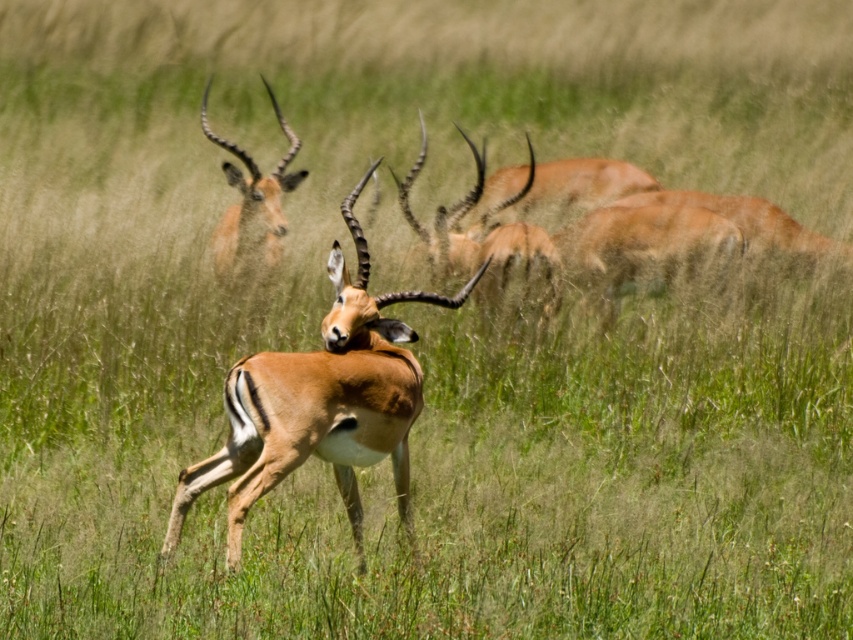
Question: Considering the relative positions of brown glossy antelope at center and brown velvet antelope at center in the image provided, where is brown glossy antelope at center located with respect to brown velvet antelope at center?

Choices:
 (A) left
 (B) right

Answer: (A)

Question: Which object is the farthest from the brown glossy antelope at center?

Choices:
 (A) brown velvet antelope at center
 (B) brown velvet antelope at upper left

Answer: (B)

Question: Which point is farther from the camera taking this photo?

Choices:
 (A) (398, 193)
 (B) (274, 99)

Answer: (A)

Question: Which point is farther from the camera taking this photo?

Choices:
 (A) (378, 323)
 (B) (225, 173)
 (C) (537, 262)

Answer: (C)

Question: Is the position of brown glossy antelope at center more distant than that of brown velvet antelope at center?

Choices:
 (A) no
 (B) yes

Answer: (A)

Question: Does brown glossy antelope at center have a lesser width compared to brown velvet antelope at upper left?

Choices:
 (A) no
 (B) yes

Answer: (A)